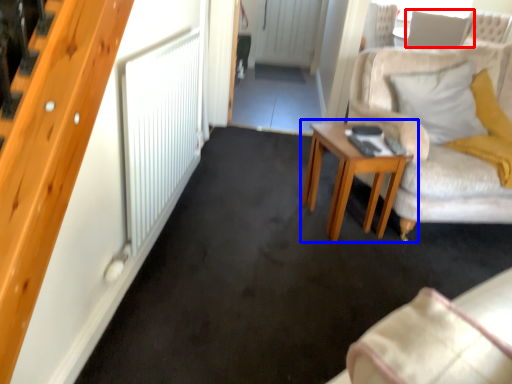
Question: Which of the following is the farthest to the observer, pillow (highlighted by a red box) or table (highlighted by a blue box)?

Choices:
 (A) pillow
 (B) table

Answer: (A)